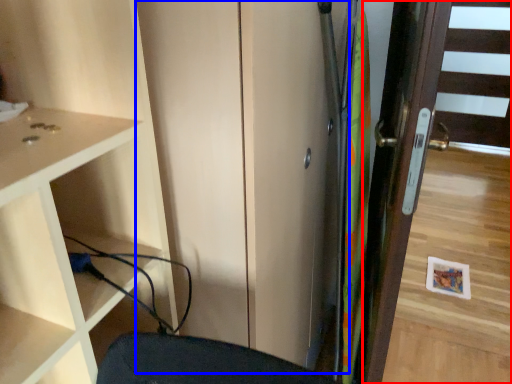
Question: Which object is further to the camera taking this photo, door (highlighted by a red box) or screen door (highlighted by a blue box)?

Choices:
 (A) door
 (B) screen door

Answer: (A)